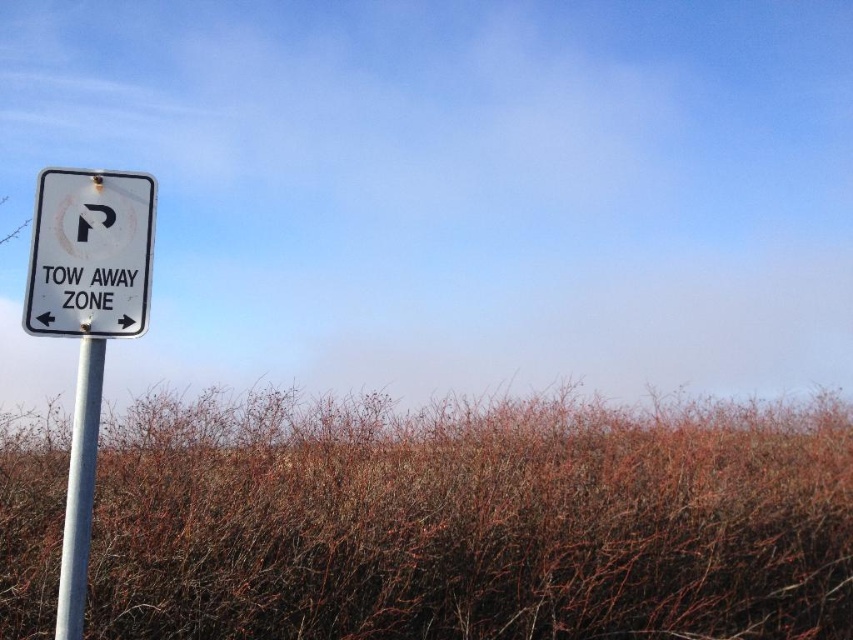
Question: Which of the following is the closest to the observer?

Choices:
 (A) brown dry grass at left
 (B) white plastic sign at upper left
 (C) metallic pole at left

Answer: (C)

Question: Can you confirm if white plastic sign at upper left is thinner than metallic pole at left?

Choices:
 (A) no
 (B) yes

Answer: (A)

Question: Is brown dry grass at left bigger than white metallic sign at left?

Choices:
 (A) no
 (B) yes

Answer: (B)

Question: Which point is farther to the camera?

Choices:
 (A) white metallic sign at left
 (B) white plastic sign at upper left

Answer: (B)

Question: From the image, what is the correct spatial relationship of white metallic sign at left in relation to metallic pole at left?

Choices:
 (A) left
 (B) right

Answer: (B)

Question: Which object is the farthest from the brown dry grass at left?

Choices:
 (A) white plastic sign at upper left
 (B) white metallic sign at left
 (C) metallic pole at left

Answer: (C)